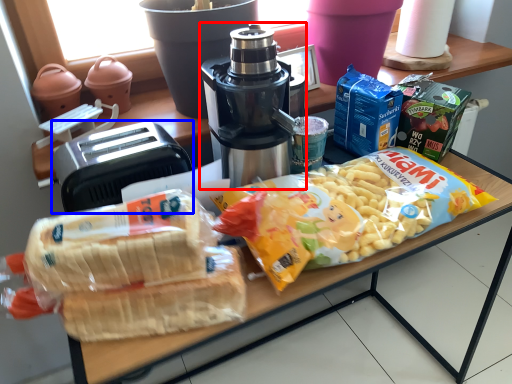
Question: Which of the following is the farthest to the observer, coffee maker (highlighted by a red box) or toaster (highlighted by a blue box)?

Choices:
 (A) coffee maker
 (B) toaster

Answer: (B)